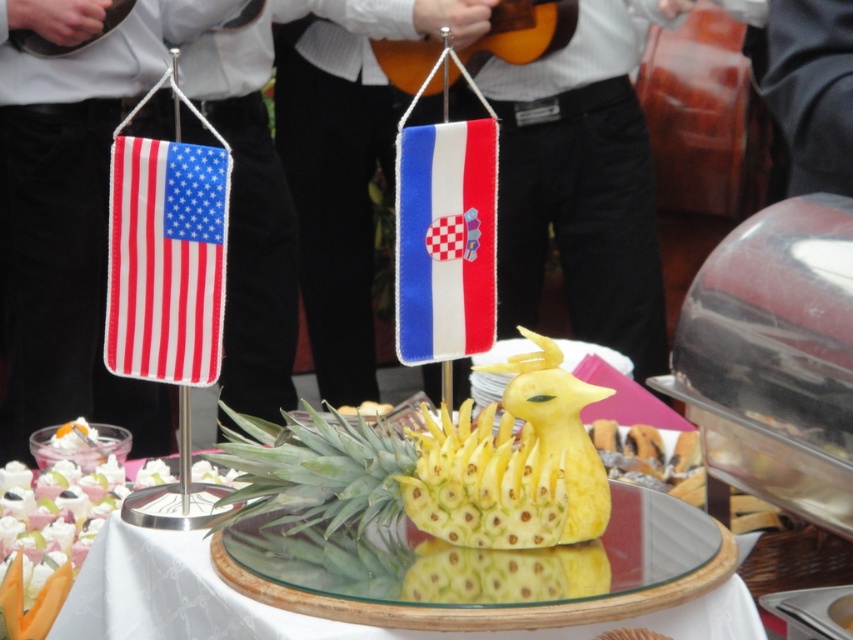
Question: Considering the real-world distances, which object is closest to the green leafy pineapple at center?

Choices:
 (A) white shirt at upper center
 (B) smooth fabric flag at left
 (C) yellow textured pineapple at center

Answer: (C)

Question: Does smooth fabric flag at left have a greater width compared to green leafy pineapple at center?

Choices:
 (A) yes
 (B) no

Answer: (B)

Question: Estimate the real-world distances between objects in this image. Which object is closer to the green leafy pineapple at center?

Choices:
 (A) smooth fabric flag at left
 (B) red-white-blue fabric flag at left
 (C) yellow textured pineapple at center
 (D) blue felt flag at center

Answer: (C)

Question: Which object appears closest to the camera in this image?

Choices:
 (A) yellow textured pineapple at center
 (B) green leafy pineapple at center
 (C) smooth fabric flag at left
 (D) white shirt at upper center

Answer: (B)

Question: Can you confirm if white shirt at upper center is positioned above yellow textured pineapple at center?

Choices:
 (A) no
 (B) yes

Answer: (B)

Question: Can you confirm if smooth fabric flag at left is smaller than yellow textured pineapple at center?

Choices:
 (A) no
 (B) yes

Answer: (A)